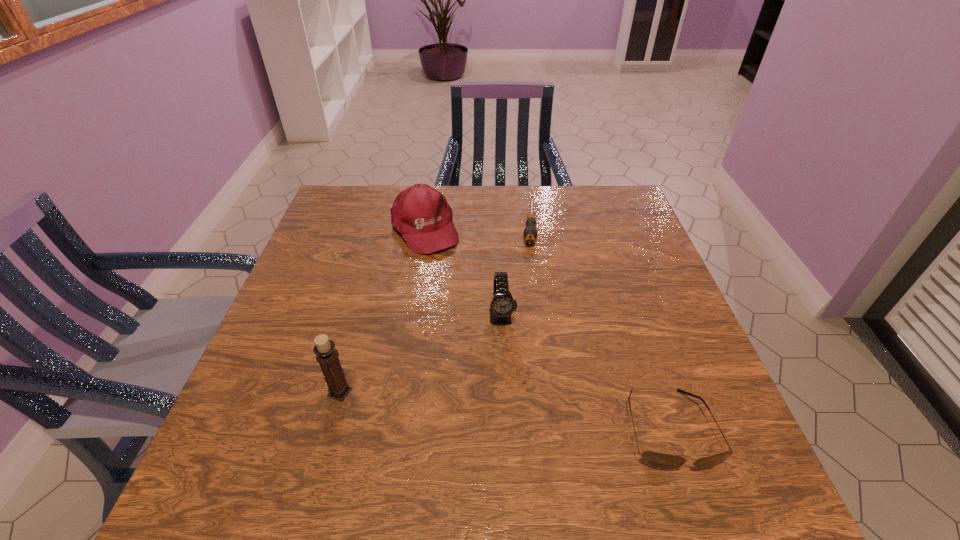
This screenshot has height=540, width=960. I want to click on vacant space on the desktop that is between the tallest object and the rightmost object and is positioned at the tip of the shortest object, so click(517, 412).

Where is `free space on the desktop that is between the tallest object and the fourth tallest object and is positioned at the front of the baseball cap with the brim`? free space on the desktop that is between the tallest object and the fourth tallest object and is positioned at the front of the baseball cap with the brim is located at coordinates (544, 415).

At what (x,y) coordinates should I click in order to perform the action: click on vacant spot on the desktop that is between the candle holder and the sunglasses and is positioned on the face of the third nearest object. Please return your answer as a coordinate pair (x, y). Image resolution: width=960 pixels, height=540 pixels. Looking at the image, I should click on (513, 411).